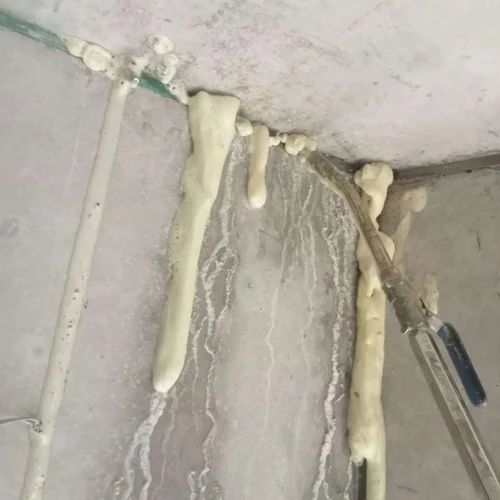
Image resolution: width=500 pixels, height=500 pixels. In order to click on white ceiling in this screenshot , I will do `click(315, 39)`.